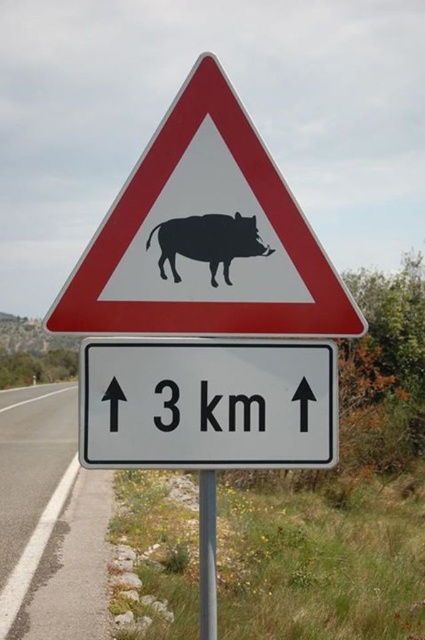
Question: Can you confirm if white asphalt road at lower left is thinner than black matte boar at center?

Choices:
 (A) no
 (B) yes

Answer: (A)

Question: Is black plastic boar at center thinner than black matte boar at center?

Choices:
 (A) no
 (B) yes

Answer: (A)

Question: Among these objects, which one is nearest to the camera?

Choices:
 (A) black plastic boar at center
 (B) white asphalt road at lower left
 (C) black matte boar at center

Answer: (A)

Question: Is black plastic boar at center further to the viewer compared to white asphalt road at lower left?

Choices:
 (A) no
 (B) yes

Answer: (A)

Question: Which object is closer to the camera taking this photo?

Choices:
 (A) black matte boar at center
 (B) white plastic sign at center
 (C) black plastic boar at center
 (D) white asphalt road at lower left

Answer: (B)

Question: Among these points, which one is nearest to the camera?

Choices:
 (A) (203, 401)
 (B) (10, 480)
 (C) (200, 504)

Answer: (C)